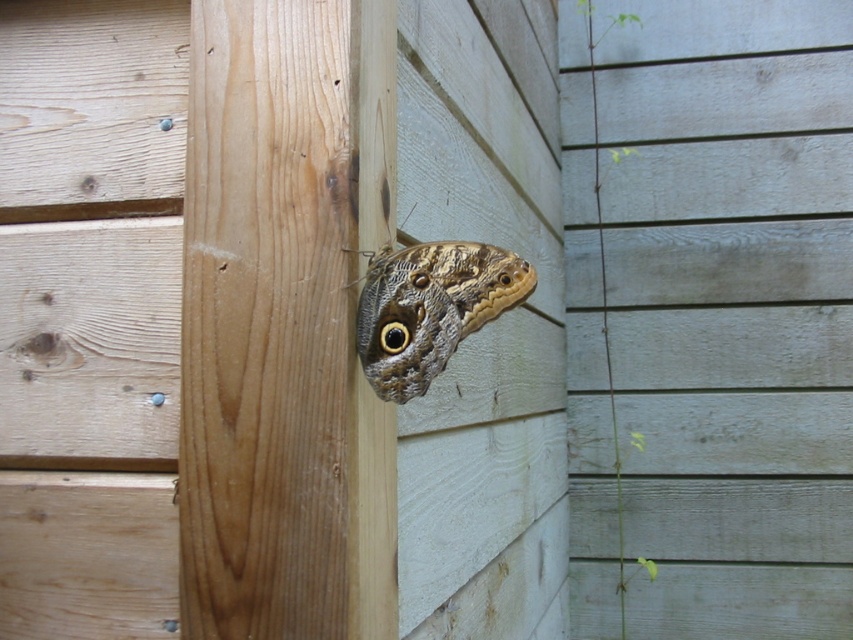
Question: Which of the following is the closest to the observer?

Choices:
 (A) natural wood at center
 (B) brown textured butterfly at center

Answer: (A)

Question: Is natural wood at center wider than brown textured butterfly at center?

Choices:
 (A) no
 (B) yes

Answer: (B)

Question: Which of the following is the farthest from the observer?

Choices:
 (A) natural wood at center
 (B) brown textured butterfly at center

Answer: (B)

Question: Can you confirm if natural wood at center is smaller than brown textured butterfly at center?

Choices:
 (A) no
 (B) yes

Answer: (A)

Question: Can you confirm if natural wood at center is smaller than brown textured butterfly at center?

Choices:
 (A) yes
 (B) no

Answer: (B)